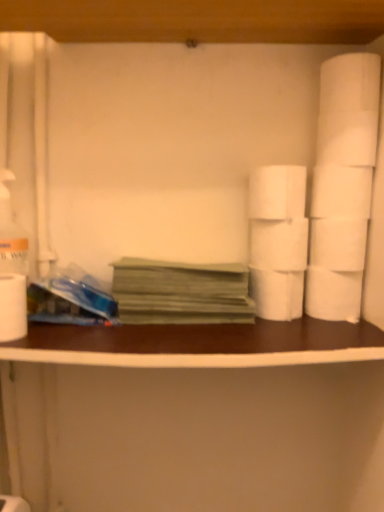
Find the location of a particular element. The width and height of the screenshot is (384, 512). white matte toilet paper at right, the fifth toilet paper positioned from the left is located at coordinates (333, 294).

Find the location of a particular element. white matte paper towel at right is located at coordinates (347, 138).

Identify the location of white matte toilet paper at left, the first toilet paper viewed from the left. The height and width of the screenshot is (512, 384). (13, 307).

At what (x,y) coordinates should I click in order to perform the action: click on white matte toilet paper at right, which appears as the 2th toilet paper when viewed from the left. Please return your answer as a coordinate pair (x, y). Looking at the image, I should click on (277, 192).

Considering the sizes of objects white matte toilet paper at right, which appears as the 2th toilet paper when viewed from the left, and white matte toilet paper at center, the 3th toilet paper positioned from the left, in the image provided, who is bigger, white matte toilet paper at right, which appears as the 2th toilet paper when viewed from the left, or white matte toilet paper at center, the 3th toilet paper positioned from the left,?

With larger size is white matte toilet paper at right, which appears as the 2th toilet paper when viewed from the left.

From the image's perspective, which is below, white matte toilet paper at right, which appears as the 2th toilet paper when viewed from the left, or white matte toilet paper at center, which appears as the sixth toilet paper when viewed from the right?

white matte toilet paper at center, which appears as the sixth toilet paper when viewed from the right, from the image's perspective.

Are white matte toilet paper at right, placed as the seventh toilet paper when sorted from right to left, and white matte toilet paper at center, which appears as the sixth toilet paper when viewed from the right, far apart?

Actually, white matte toilet paper at right, placed as the seventh toilet paper when sorted from right to left, and white matte toilet paper at center, which appears as the sixth toilet paper when viewed from the right, are a little close together.

Who is bigger, white matte toilet paper at right, placed as the seventh toilet paper when sorted from right to left, or green paper at center?

Bigger between the two is green paper at center.

How different are the orientations of white matte toilet paper at right, placed as the seventh toilet paper when sorted from right to left, and green paper at center in degrees?

They differ by 1.69 degrees in their facing directions.

Which is farther from the camera, (272, 187) or (204, 314)?

The point (204, 314) is behind.

From the image's perspective, is white matte toilet paper at right, placed as the seventh toilet paper when sorted from right to left, located above or below green paper at center?

white matte toilet paper at right, placed as the seventh toilet paper when sorted from right to left, is above green paper at center.

Which is less distant, (12,355) or (130,295)?

Point (12,355) appears to be closer to the viewer than point (130,295).

Is white matte counter top at center at the left side of green paper at center?

No, white matte counter top at center is not to the left of green paper at center.

This screenshot has width=384, height=512. I want to click on book on the left of the white matte counter top at center, so click(181, 292).

From a real-world perspective, which is physically below, white matte counter top at center or green paper at center?

In real-world perspective, white matte counter top at center is lower.

From the image's perspective, relative to white matte toilet paper at right, arranged as the fifth toilet paper when viewed from the right, is white matte counter top at center above or below?

From the image's perspective, white matte counter top at center appears below white matte toilet paper at right, arranged as the fifth toilet paper when viewed from the right.

Considering the sizes of white matte counter top at center and white matte toilet paper at right, the 4th toilet paper in the left-to-right sequence, in the image, is white matte counter top at center bigger or smaller than white matte toilet paper at right, the 4th toilet paper in the left-to-right sequence,?

Clearly, white matte counter top at center is larger in size than white matte toilet paper at right, the 4th toilet paper in the left-to-right sequence.

How different are the orientations of white matte toilet paper at left, the first toilet paper viewed from the left, and white matte counter top at center in degrees?

5.1 degrees.

In the image, is white matte toilet paper at left, which is the 8th toilet paper in right-to-left order, on the left side or the right side of white matte counter top at center?

In the image, white matte toilet paper at left, which is the 8th toilet paper in right-to-left order, appears on the left side of white matte counter top at center.

Is point (23, 300) closer to viewer compared to point (359, 331)?

Yes, it is in front of point (359, 331).

In terms of size, does white matte toilet paper at left, which is the 8th toilet paper in right-to-left order, appear bigger or smaller than white matte counter top at center?

Considering their sizes, white matte toilet paper at left, which is the 8th toilet paper in right-to-left order, takes up less space than white matte counter top at center.

Does white matte toilet paper at right, placed as the 2th toilet paper when sorted from right to left, have a larger size compared to white matte paper towel at right?

Yes.

From the white matte paper towel at right, count 2nd toilet papers backward and point to it. Please provide its 2D coordinates.

[(341, 191)]

Is white matte toilet paper at right, placed as the 2th toilet paper when sorted from right to left, at the right side of white matte paper towel at right?

Incorrect, white matte toilet paper at right, placed as the 2th toilet paper when sorted from right to left, is not on the right side of white matte paper towel at right.

Is white matte toilet paper at right, arranged as the 7th toilet paper when viewed from the left, directly adjacent to white matte paper towel at right?

Absolutely, white matte toilet paper at right, arranged as the 7th toilet paper when viewed from the left, is next to and touching white matte paper towel at right.

Relative to white matte paper towel at right, is white matte toilet paper at right, placed as the third toilet paper when sorted from right to left, in front or behind?

Clearly, white matte toilet paper at right, placed as the third toilet paper when sorted from right to left, is behind white matte paper towel at right.

From a real-world perspective, which is physically above, white matte toilet paper at right, marked as the 6th toilet paper in a left-to-right arrangement, or white matte paper towel at right?

white matte paper towel at right is physically above.

Can you confirm if white matte toilet paper at right, placed as the third toilet paper when sorted from right to left, is smaller than white matte paper towel at right?

No.

Is white matte toilet paper at right, placed as the third toilet paper when sorted from right to left, facing away from white matte paper towel at right?

No, white matte toilet paper at right, placed as the third toilet paper when sorted from right to left, is not facing away from white matte paper towel at right.

At what (x,y) coordinates should I click in order to perform the action: click on the 4th toilet paper in front of the white matte toilet paper at center, the 3th toilet paper positioned from the left, counting from the anchor's position. Please return your answer as a coordinate pair (x, y). The height and width of the screenshot is (512, 384). Looking at the image, I should click on (277, 192).

Identify the location of the 3rd toilet paper directly above the green paper at center (from a real-world perspective). (277, 192).

Based on their spatial positions, is white matte toilet paper at center, the 3th toilet paper positioned from the left, or white matte toilet paper at right, placed as the seventh toilet paper when sorted from right to left, closer to white matte toilet paper at right, the fifth toilet paper positioned from the left?

white matte toilet paper at center, the 3th toilet paper positioned from the left.

Based on their spatial positions, is white matte toilet paper at right, placed as the 2th toilet paper when sorted from right to left, or white matte toilet paper at right, placed as the third toilet paper when sorted from right to left, further from white matte toilet paper at right, which appears as the 2th toilet paper when viewed from the left?

white matte toilet paper at right, placed as the third toilet paper when sorted from right to left.

Estimate the real-world distances between objects in this image. Which object is further from white matte paper towel at right, white matte toilet paper at right, placed as the third toilet paper when sorted from right to left, or white matte toilet paper at right, the 4th toilet paper positioned from the right?

The object further to white matte paper towel at right is white matte toilet paper at right, the 4th toilet paper positioned from the right.

When comparing their distances from white matte paper towel at right, does green paper at center or white matte toilet paper at right, placed as the third toilet paper when sorted from right to left, seem further?

Based on the image, green paper at center appears to be further to white matte paper towel at right.

From the image, which object appears to be nearer to white matte toilet paper at right, marked as the 6th toilet paper in a left-to-right arrangement, white matte paper towel at right or white matte toilet paper at right, placed as the eighth toilet paper when sorted from left to right?

white matte paper towel at right is positioned closer to the anchor white matte toilet paper at right, marked as the 6th toilet paper in a left-to-right arrangement.

Looking at the image, which one is located closer to white matte toilet paper at right, arranged as the fifth toilet paper when viewed from the right, green paper at center or white matte toilet paper at right, arranged as the 7th toilet paper when viewed from the left?

Based on the image, white matte toilet paper at right, arranged as the 7th toilet paper when viewed from the left, appears to be nearer to white matte toilet paper at right, arranged as the fifth toilet paper when viewed from the right.

When comparing their distances from white matte toilet paper at center, which appears as the sixth toilet paper when viewed from the right, does white matte counter top at center or white matte toilet paper at left, which is the 8th toilet paper in right-to-left order, seem closer?

Based on the image, white matte counter top at center appears to be nearer to white matte toilet paper at center, which appears as the sixth toilet paper when viewed from the right.

When comparing their distances from white matte toilet paper at right, placed as the 2th toilet paper when sorted from right to left, does white matte toilet paper at right, the 4th toilet paper in the left-to-right sequence, or white matte paper towel at right seem further?

white matte toilet paper at right, the 4th toilet paper in the left-to-right sequence, is further to white matte toilet paper at right, placed as the 2th toilet paper when sorted from right to left.

The width and height of the screenshot is (384, 512). Identify the location of counter top between white matte toilet paper at left, which is the 8th toilet paper in right-to-left order, and white matte toilet paper at right, placed as the 2th toilet paper when sorted from right to left, in the horizontal direction. (199, 344).

I want to click on book between white matte toilet paper at right, placed as the seventh toilet paper when sorted from right to left, and white matte toilet paper at center, which appears as the sixth toilet paper when viewed from the right, vertically, so click(181, 292).

This screenshot has width=384, height=512. Find the location of `book between white matte paper towel at right and white matte toilet paper at center, which appears as the sixth toilet paper when viewed from the right, in the vertical direction`. book between white matte paper towel at right and white matte toilet paper at center, which appears as the sixth toilet paper when viewed from the right, in the vertical direction is located at coordinates (181, 292).

Where is `counter top situated between white matte toilet paper at left, which is the 8th toilet paper in right-to-left order, and white matte toilet paper at center, which appears as the sixth toilet paper when viewed from the right, from left to right`? This screenshot has width=384, height=512. counter top situated between white matte toilet paper at left, which is the 8th toilet paper in right-to-left order, and white matte toilet paper at center, which appears as the sixth toilet paper when viewed from the right, from left to right is located at coordinates (199, 344).